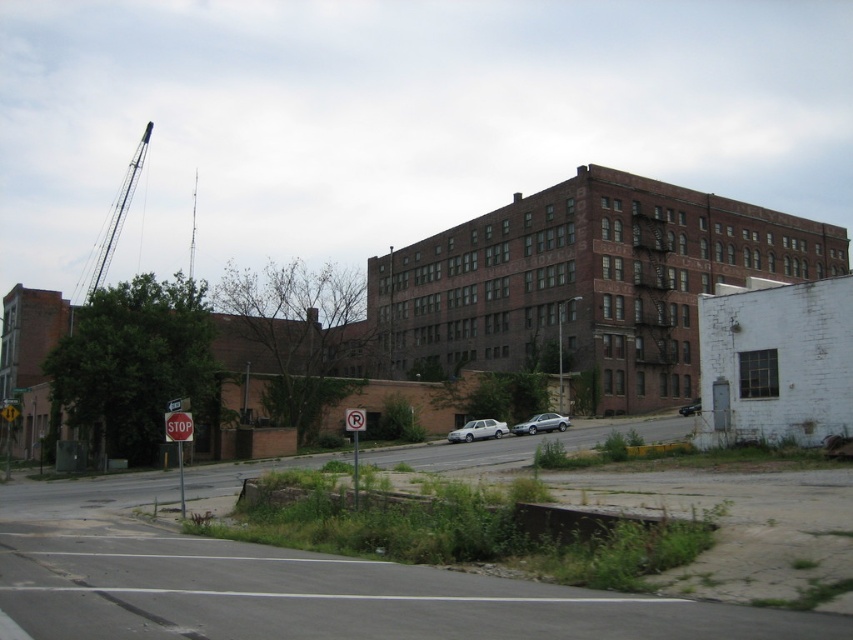
Can you confirm if white matte sedan at center is thinner than silver metallic sedan at center-right?

Incorrect, white matte sedan at center's width is not less than silver metallic sedan at center-right's.

Find the location of a particular element. white matte sedan at center is located at coordinates (479, 429).

I want to click on white matte sedan at center, so click(479, 429).

The image size is (853, 640). I want to click on white matte sedan at center, so click(479, 429).

Who is taller, metallic gray crane at upper left or silver metallic sedan at center-right?

metallic gray crane at upper left

Between point (131, 173) and point (544, 420), which one is positioned in front?

Positioned in front is point (544, 420).

This screenshot has height=640, width=853. Find the location of `metallic gray crane at upper left`. metallic gray crane at upper left is located at coordinates (117, 214).

Does silver metallic sedan at center-right have a lesser width compared to red painted metal stop sign at center?

Yes.

Is point (543, 413) positioned in front of point (166, 435)?

That is False.

This screenshot has width=853, height=640. Find the location of `silver metallic sedan at center-right`. silver metallic sedan at center-right is located at coordinates (541, 422).